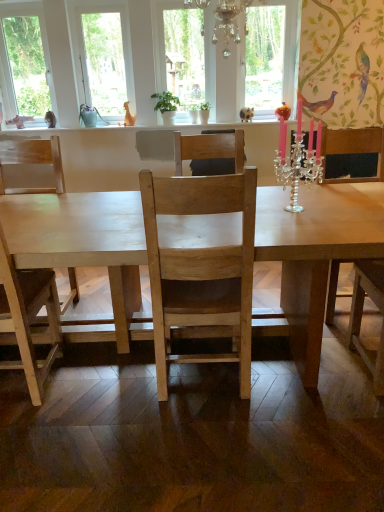
Find the location of a particular element. This screenshot has width=384, height=512. vacant location below silver/crystal candle holder at upper right (from a real-world perspective) is located at coordinates (291, 212).